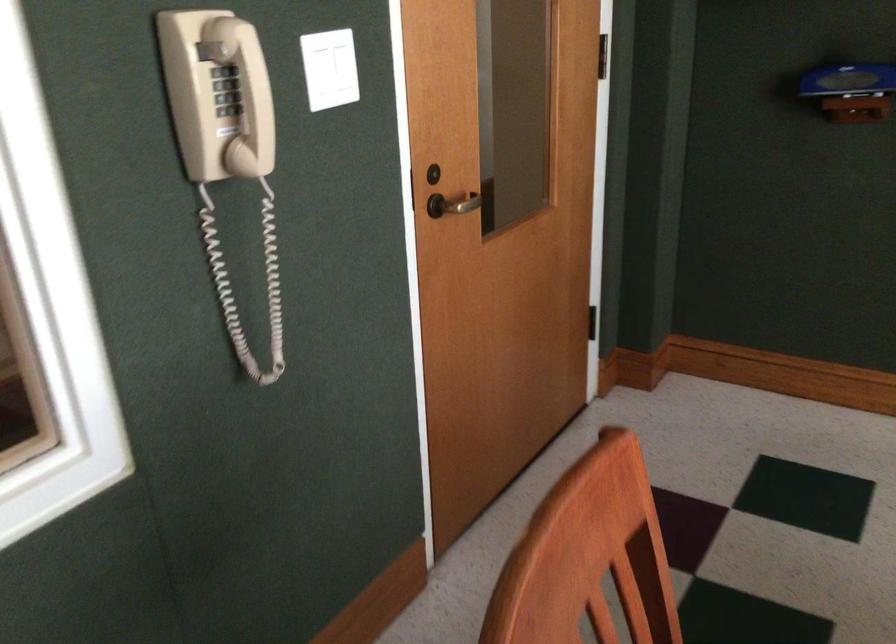
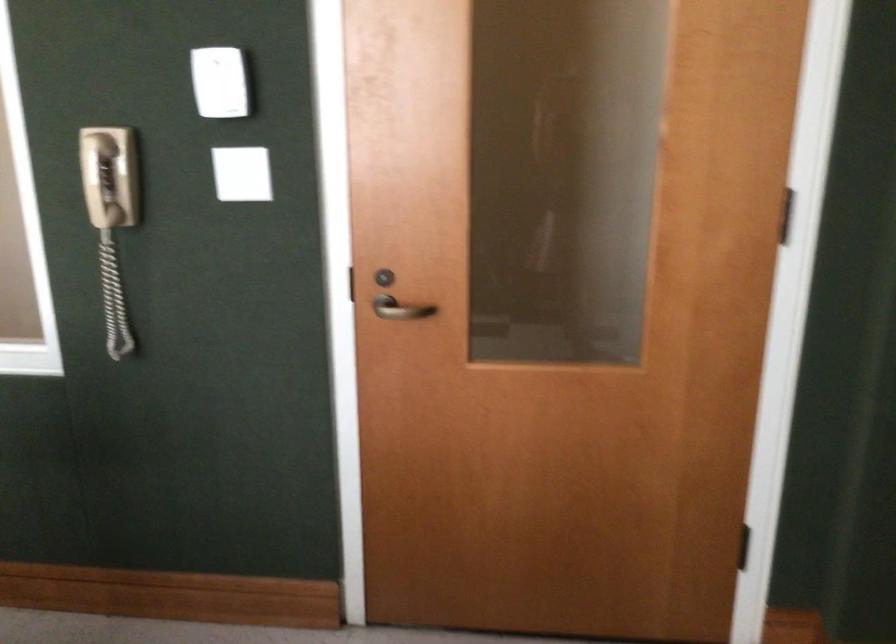
Find the pixel in the second image that matches the point at 250,80 in the first image.

(99, 180)